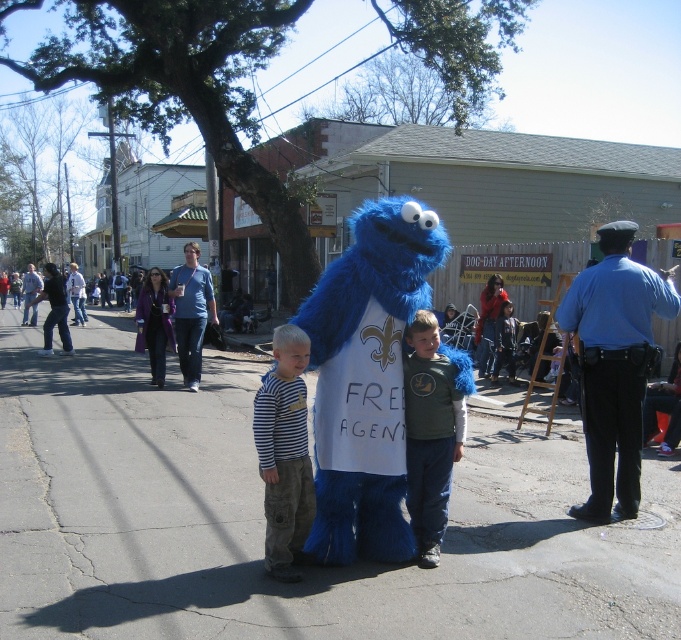
You are a photographer trying to capture a clear shot of the blue fuzzy hat at right and the denim jacket at center. Since you want to focus on the thinner object, which one should you aim your camera at?

The blue fuzzy hat at right is thinner than the denim jacket at center, so you should aim your camera at the blue fuzzy hat at right to focus on the thinner object.

You are a photographer at the event and want to take a photo of the fuzzy blue mascot at center without the blue fuzzy hat at right appearing in the frame. Is this possible given their positions?

The fuzzy blue mascot at center is positioned under the blue fuzzy hat at right, so the hat is above the mascot. Since the hat is above, you can angle the camera downward to exclude the hat from the frame.

You are a photographer trying to capture both the striped cotton shirt at center and the denim jacket at center in a single frame. Based on their sizes, which clothing item should you focus on to ensure both are clearly visible in the photo?

The striped cotton shirt at center is smaller than the denim jacket at center, so focusing on the denim jacket at center would allow both items to be clearly visible in the photo since it is larger and easier to frame.